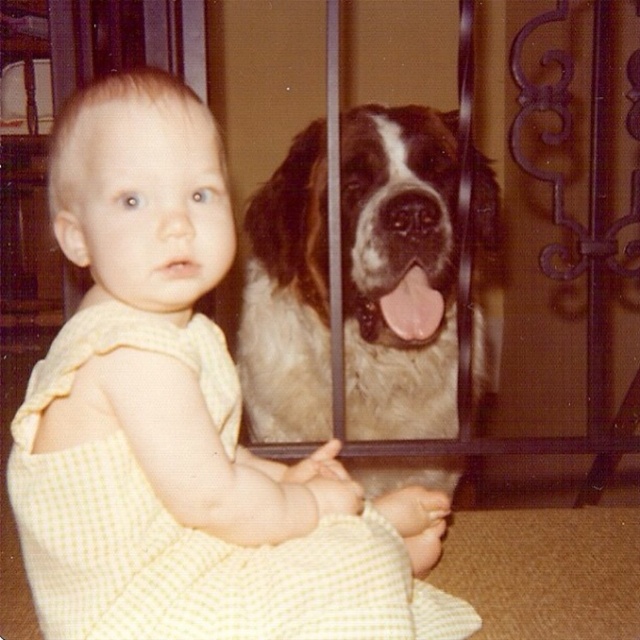
Question: Which point is closer to the camera taking this photo?

Choices:
 (A) (244, 508)
 (B) (452, 218)

Answer: (A)

Question: In this image, where is yellow checkered dress at center located relative to fuzzy white dog at center?

Choices:
 (A) below
 (B) above

Answer: (A)

Question: Can you confirm if yellow checkered dress at center is positioned above fuzzy white dog at center?

Choices:
 (A) yes
 (B) no

Answer: (B)

Question: Does yellow checkered dress at center have a lesser width compared to fuzzy white dog at center?

Choices:
 (A) yes
 (B) no

Answer: (B)